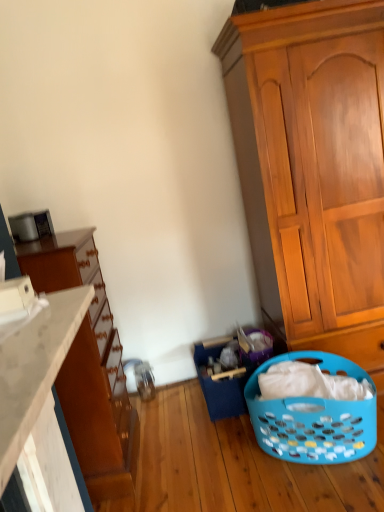
Where is `free space above white matte countertop at lower left (from a real-world perspective)`? The height and width of the screenshot is (512, 384). free space above white matte countertop at lower left (from a real-world perspective) is located at coordinates (26, 337).